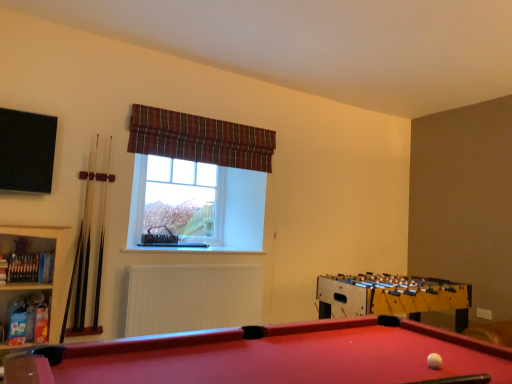
At what (x,y) coordinates should I click in order to perform the action: click on free spot above white textured radiator at center (from a real-world perspective). Please return your answer as a coordinate pair (x, y). Looking at the image, I should click on (210, 259).